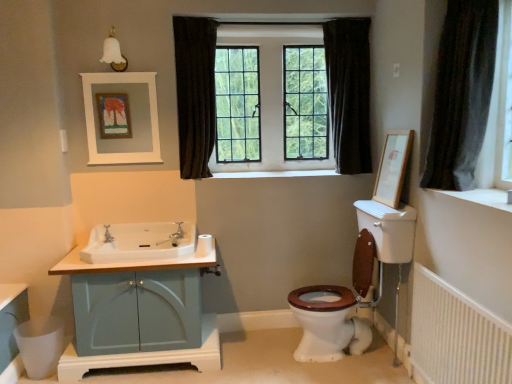
Question: Considering the positions of white textured radiator at lower right and matte silver faucet at center, the first tap positioned from the right, in the image, is white textured radiator at lower right taller or shorter than matte silver faucet at center, the first tap positioned from the right,?

Choices:
 (A) short
 (B) tall

Answer: (B)

Question: From the image's perspective, is white textured radiator at lower right above or below matte silver faucet at center, which is the second tap from left to right?

Choices:
 (A) above
 (B) below

Answer: (B)

Question: Estimate the real-world distances between objects in this image. Which object is closer to the brushed metal faucet at sink left, positioned as the first tap in left-to-right order?

Choices:
 (A) white smooth window sill at upper right, marked as the 2th window sill in a back-to-front arrangement
 (B) dark fabric curtain at center, acting as the 2th curtain starting from the right
 (C) dark fabric curtain at upper right, the first curtain when ordered from right to left
 (D) matte blue cabinet at left
 (E) white glossy sink at center left

Answer: (E)

Question: Estimate the real-world distances between objects in this image. Which object is closer to the white matte picture frame at upper center, which is the 1th picture frame in left-to-right order?

Choices:
 (A) dark fabric curtain at upper center, the 3th curtain positioned from the right
 (B) white smooth window sill at center, the 1th window sill viewed from the top
 (C) white glossy sink at center left
 (D) dark fabric curtain at center, which appears as the third curtain when viewed from the front
 (E) brushed metal faucet at sink left, positioned as the first tap in left-to-right order

Answer: (A)